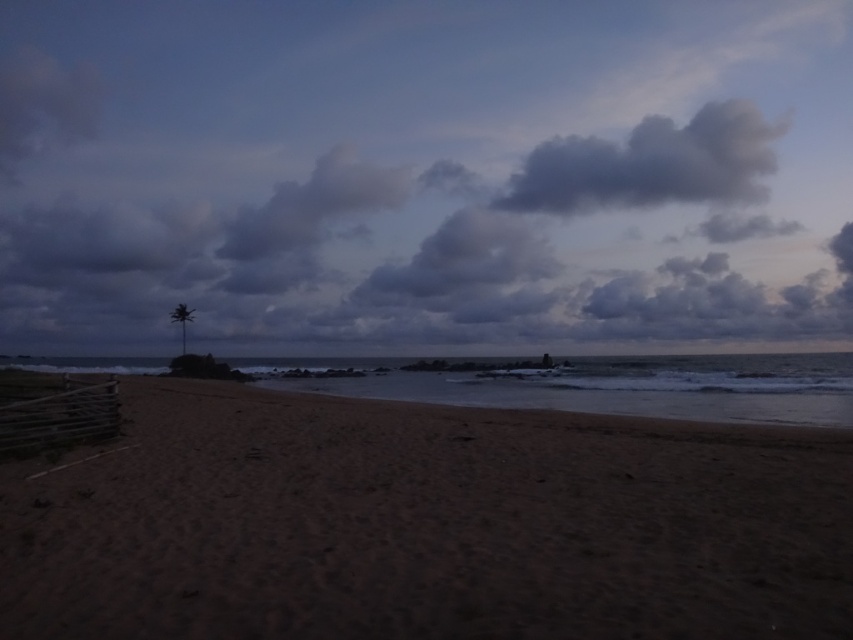
Who is shorter, brown sandy beach at center or dark gray fluffy cloud at upper center?

brown sandy beach at center is shorter.

Where is `brown sandy beach at center`? The image size is (853, 640). brown sandy beach at center is located at coordinates (424, 524).

Find the location of a particular element. The width and height of the screenshot is (853, 640). brown sandy beach at center is located at coordinates (424, 524).

Can you confirm if sandy water at center is taller than green leafy palm tree at left?

No, sandy water at center is not taller than green leafy palm tree at left.

Does sandy water at center have a lesser height compared to green leafy palm tree at left?

Indeed, sandy water at center has a lesser height compared to green leafy palm tree at left.

This screenshot has width=853, height=640. What are the coordinates of `sandy water at center` in the screenshot? It's located at (619, 387).

Where is `sandy water at center`? Image resolution: width=853 pixels, height=640 pixels. sandy water at center is located at coordinates (619, 387).

Which is behind, point (59, 232) or point (308, 208)?

Point (59, 232)

Which is in front, point (294, 280) or point (403, 170)?

Point (294, 280)

This screenshot has width=853, height=640. What are the coordinates of `cloudy sky at upper center` in the screenshot? It's located at (425, 177).